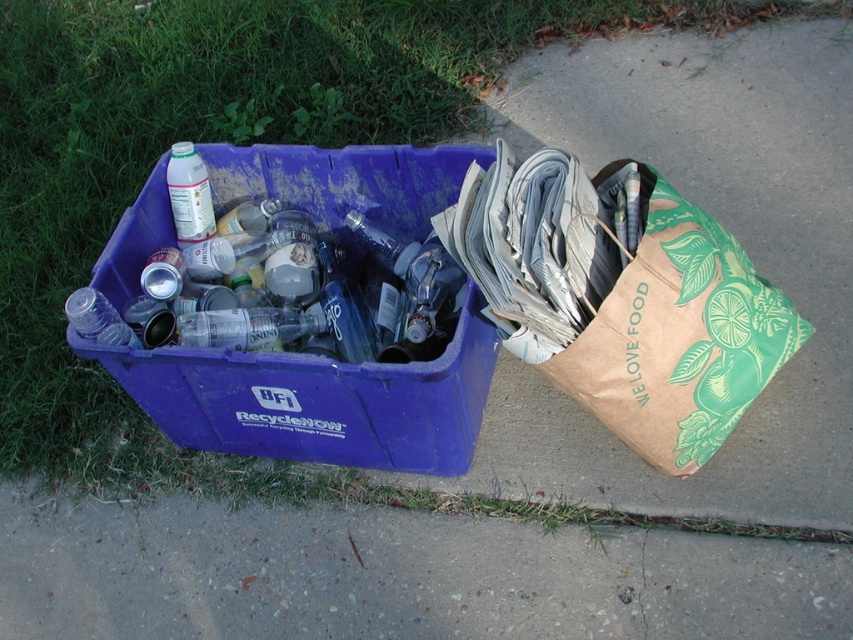
What do you see at coordinates (189, 195) in the screenshot? I see `translucent plastic bottle at upper left` at bounding box center [189, 195].

Does translucent plastic bottle at upper left have a lesser width compared to transparent plastic bottle at left?

Yes.

Find the location of a particular element. This screenshot has height=640, width=853. translucent plastic bottle at upper left is located at coordinates (189, 195).

Between matte plastic recycling bin at left and translucent plastic bottle at upper left, which one appears on the left side from the viewer's perspective?

Positioned to the left is translucent plastic bottle at upper left.

Does point (223, 374) come closer to viewer compared to point (189, 147)?

Yes, it is.

Does point (378, 429) lie in front of point (200, 227)?

Yes, it is in front of point (200, 227).

Where is `matte plastic recycling bin at left`? The width and height of the screenshot is (853, 640). matte plastic recycling bin at left is located at coordinates (316, 401).

What do you see at coordinates (630, 304) in the screenshot?
I see `brown paper bag at right` at bounding box center [630, 304].

Who is shorter, brown paper bag at right or transparent plastic bottle at left?

Standing shorter between the two is transparent plastic bottle at left.

Does point (607, 296) lie in front of point (71, 305)?

Yes, it is.

This screenshot has height=640, width=853. In order to click on brown paper bag at right in this screenshot , I will do `click(630, 304)`.